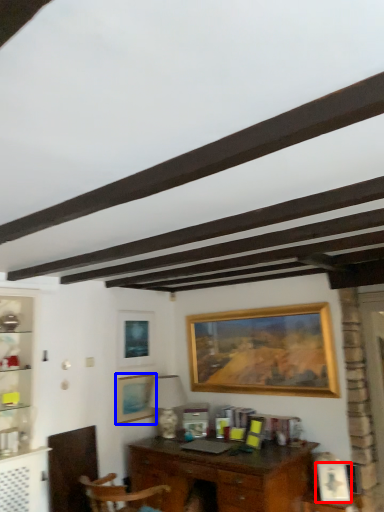
Question: Which object appears farthest to the camera in this image, picture frame (highlighted by a red box) or picture frame (highlighted by a blue box)?

Choices:
 (A) picture frame
 (B) picture frame

Answer: (B)